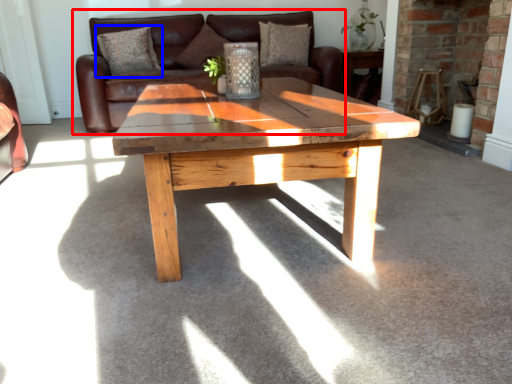
Question: Which object appears closest to the camera in this image, studio couch (highlighted by a red box) or pillow (highlighted by a blue box)?

Choices:
 (A) studio couch
 (B) pillow

Answer: (A)